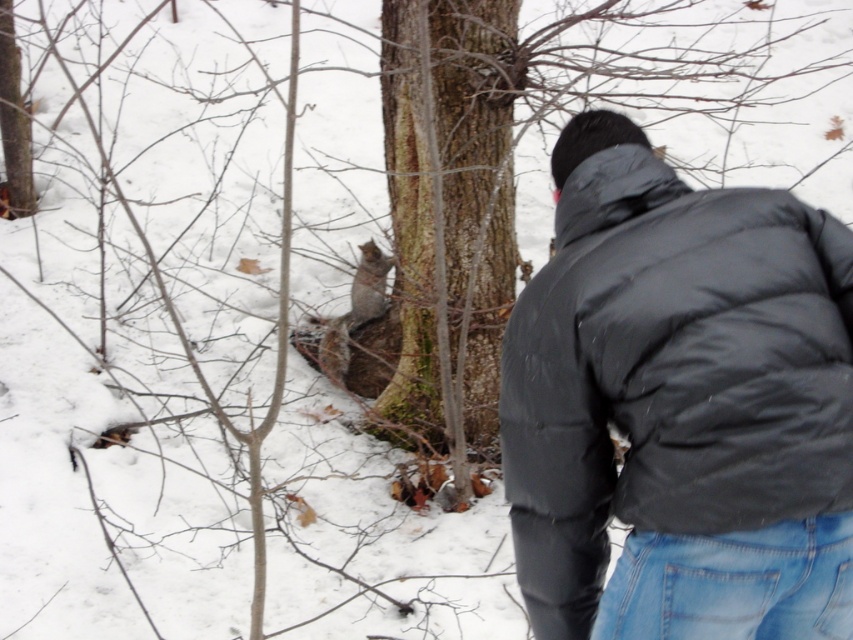
Does black puffy jacket at upper right appear over gray fur squirrel at center?

Incorrect, black puffy jacket at upper right is not positioned above gray fur squirrel at center.

Can you confirm if black puffy jacket at upper right is bigger than gray fur squirrel at center?

Indeed, black puffy jacket at upper right has a larger size compared to gray fur squirrel at center.

What do you see at coordinates (637, 378) in the screenshot?
I see `black puffy jacket at upper right` at bounding box center [637, 378].

At what (x,y) coordinates should I click in order to perform the action: click on black puffy jacket at upper right. Please return your answer as a coordinate pair (x, y). The height and width of the screenshot is (640, 853). Looking at the image, I should click on (637, 378).